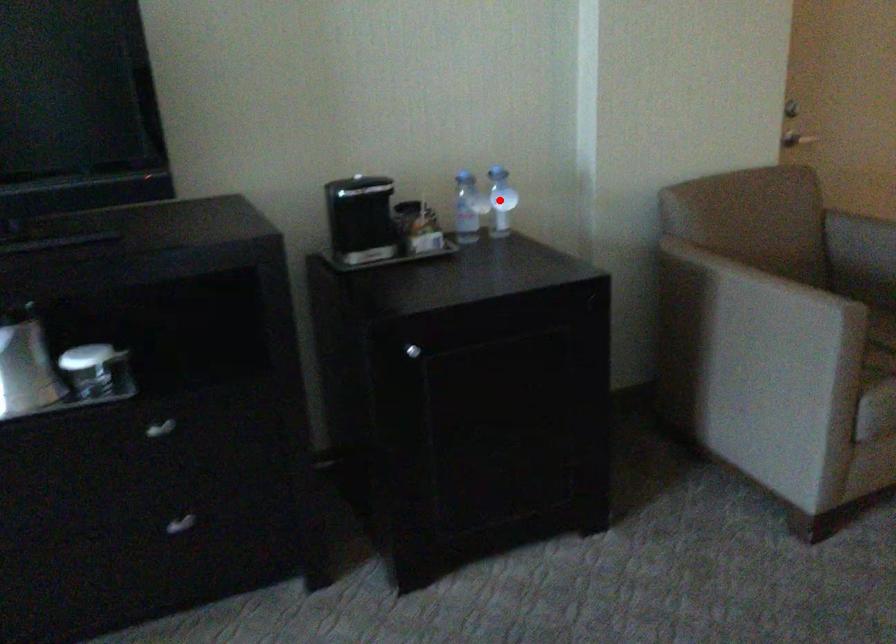
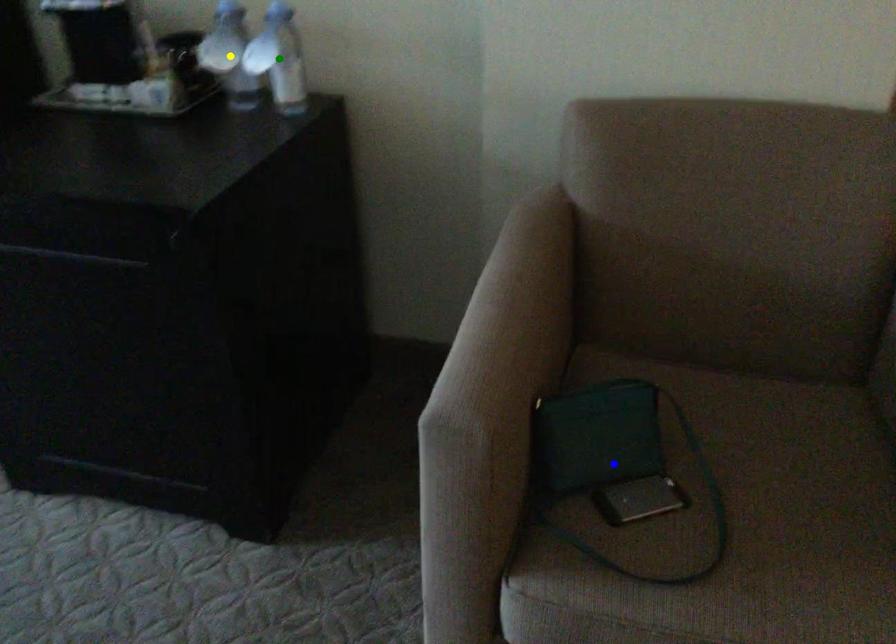
Question: I am providing you with two images of the same scene from different viewpoints. A red point is marked on the first image. You are given multiple points on the second image. Which point in image 2 is actually the same real-world point as the red point in image 1?

Choices:
 (A) green point
 (B) yellow point
 (C) blue point

Answer: (A)